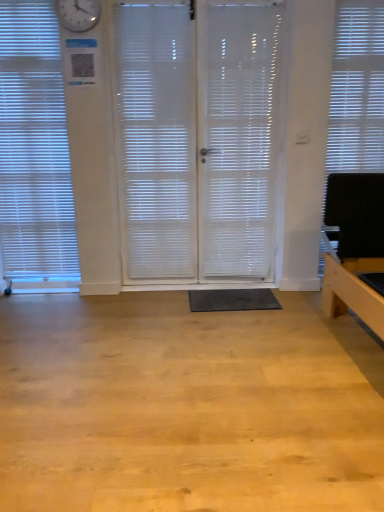
Question: From the image's perspective, is white frosted glass shutter at center below white translucent screen door at center, arranged as the 2th screen door when viewed from the left?

Choices:
 (A) yes
 (B) no

Answer: (B)

Question: Does white frosted glass shutter at center lie in front of white translucent screen door at center, the 1th screen door viewed from the right?

Choices:
 (A) yes
 (B) no

Answer: (B)

Question: Can you confirm if white frosted glass shutter at center is thinner than white translucent screen door at center, arranged as the 2th screen door when viewed from the left?

Choices:
 (A) no
 (B) yes

Answer: (B)

Question: Are white frosted glass shutter at center and white translucent screen door at center, the 1th screen door viewed from the right, far apart?

Choices:
 (A) no
 (B) yes

Answer: (A)

Question: Is white frosted glass shutter at center surrounding white translucent screen door at center, the 1th screen door viewed from the right?

Choices:
 (A) no
 (B) yes

Answer: (A)

Question: In terms of height, does white translucent screen door at center, the 1th screen door viewed from the right, look taller or shorter compared to transparent plastic screen door at center, the 1th screen door positioned from the left?

Choices:
 (A) short
 (B) tall

Answer: (A)

Question: From a real-world perspective, is white translucent screen door at center, the 1th screen door viewed from the right, above or below transparent plastic screen door at center, the 2th screen door from the right?

Choices:
 (A) above
 (B) below

Answer: (B)

Question: Is white translucent screen door at center, arranged as the 2th screen door when viewed from the left, spatially inside transparent plastic screen door at center, the 1th screen door positioned from the left, or outside of it?

Choices:
 (A) outside
 (B) inside

Answer: (B)

Question: Considering their positions, is white translucent screen door at center, the 1th screen door viewed from the right, located in front of or behind transparent plastic screen door at center, the 2th screen door from the right?

Choices:
 (A) front
 (B) behind

Answer: (A)

Question: Is white translucent screen door at center, the 1th screen door viewed from the right, taller or shorter than black rubber mat at center?

Choices:
 (A) tall
 (B) short

Answer: (A)

Question: Based on their positions, is white translucent screen door at center, the 1th screen door viewed from the right, located to the left or right of black rubber mat at center?

Choices:
 (A) right
 (B) left

Answer: (A)

Question: Is point (269, 105) positioned closer to the camera than point (271, 300)?

Choices:
 (A) farther
 (B) closer

Answer: (A)

Question: From a real-world perspective, is white translucent screen door at center, arranged as the 2th screen door when viewed from the left, above or below black rubber mat at center?

Choices:
 (A) below
 (B) above

Answer: (B)

Question: From a real-world perspective, is white frosted glass shutter at center above or below white matte window blind at right, which is counted as the second window blind, starting from the left?

Choices:
 (A) below
 (B) above

Answer: (A)

Question: Considering the positions of point (139, 134) and point (342, 59), is point (139, 134) closer or farther from the camera than point (342, 59)?

Choices:
 (A) farther
 (B) closer

Answer: (A)